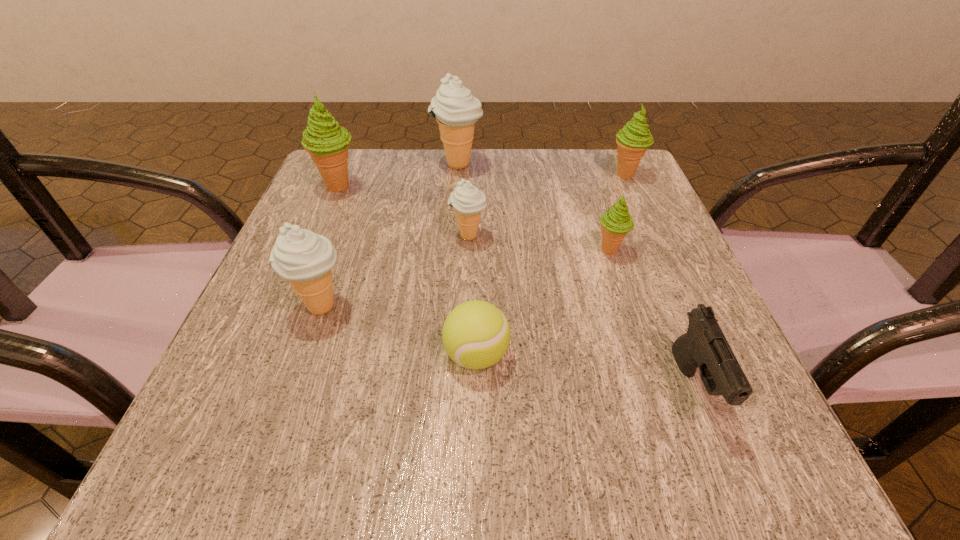
At what (x,y) coordinates should I click in order to perform the action: click on the farthest beige icecream. Please return your answer as a coordinate pair (x, y). Looking at the image, I should click on (456, 110).

At what (x,y) coordinates should I click in order to perform the action: click on the leftmost green icecream. Please return your answer as a coordinate pair (x, y). Looking at the image, I should click on (327, 143).

Locate an element on the screen. The image size is (960, 540). the second smallest green icecream is located at coordinates (633, 139).

This screenshot has height=540, width=960. What are the coordinates of `the rightmost green icecream` in the screenshot? It's located at (633, 139).

You are a GUI agent. You are given a task and a screenshot of the screen. Output one action in this format:
    pyautogui.click(x=<x>, y=<y>)
    Task: Click on the leftmost beige icecream
    The height and width of the screenshot is (540, 960).
    Given the screenshot: What is the action you would take?
    pyautogui.click(x=304, y=258)

Where is `the nearest icecream`? This screenshot has width=960, height=540. the nearest icecream is located at coordinates pos(304,258).

Where is `the second nearest beige icecream`? the second nearest beige icecream is located at coordinates (468, 201).

The width and height of the screenshot is (960, 540). I want to click on the smallest green icecream, so click(615, 223).

This screenshot has width=960, height=540. Identify the location of the third object from right to left. (615, 223).

Identify the location of pistol. (704, 345).